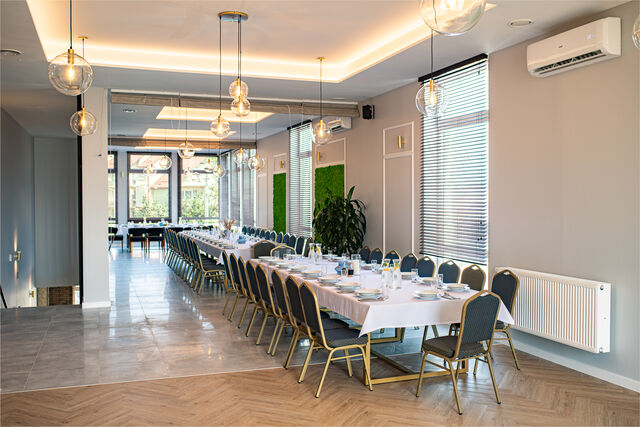
Image resolution: width=640 pixels, height=427 pixels. Find the location of `windows`. windows is located at coordinates (108, 180), (157, 199), (188, 197), (225, 198), (234, 193), (244, 184), (300, 184), (456, 184).